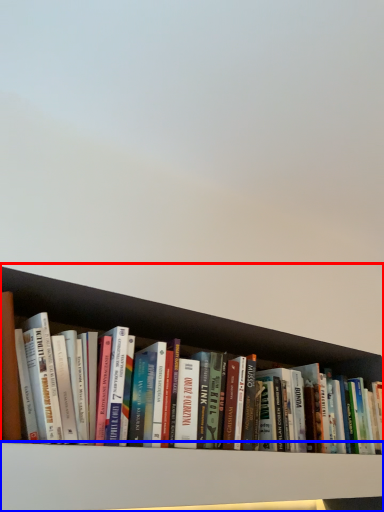
Question: Which point is further to the camera, shelf (highlighted by a red box) or shelf (highlighted by a blue box)?

Choices:
 (A) shelf
 (B) shelf

Answer: (A)